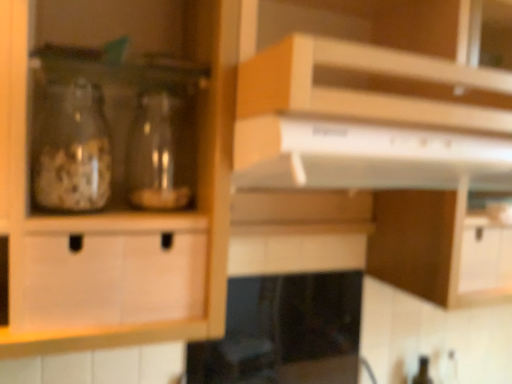
Question: From the image's perspective, does white glossy exhaust hood at upper center appear higher than black glass stove at lower center?

Choices:
 (A) yes
 (B) no

Answer: (A)

Question: Can you confirm if white glossy exhaust hood at upper center is wider than black glass stove at lower center?

Choices:
 (A) no
 (B) yes

Answer: (A)

Question: Is white glossy exhaust hood at upper center next to black glass stove at lower center?

Choices:
 (A) yes
 (B) no

Answer: (B)

Question: Is black glass stove at lower center a part of white glossy exhaust hood at upper center?

Choices:
 (A) no
 (B) yes

Answer: (A)

Question: Is white glossy exhaust hood at upper center thinner than black glass stove at lower center?

Choices:
 (A) no
 (B) yes

Answer: (B)

Question: Is the depth of white glossy exhaust hood at upper center greater than that of black glass stove at lower center?

Choices:
 (A) no
 (B) yes

Answer: (B)

Question: From the image's perspective, is black glass stove at lower center located beneath transparent glass jar at left, the 2th glass bottle when ordered from right to left?

Choices:
 (A) no
 (B) yes

Answer: (B)

Question: Is black glass stove at lower center facing away from transparent glass jar at left, the first glass bottle from the left?

Choices:
 (A) no
 (B) yes

Answer: (A)

Question: From a real-world perspective, is black glass stove at lower center beneath transparent glass jar at left, the 2th glass bottle when ordered from right to left?

Choices:
 (A) no
 (B) yes

Answer: (B)

Question: From a real-world perspective, is black glass stove at lower center over transparent glass jar at left, the first glass bottle from the left?

Choices:
 (A) yes
 (B) no

Answer: (B)

Question: Considering the relative sizes of black glass stove at lower center and transparent glass jar at left, the first glass bottle from the left, in the image provided, is black glass stove at lower center wider than transparent glass jar at left, the first glass bottle from the left,?

Choices:
 (A) no
 (B) yes

Answer: (B)

Question: From the image's perspective, is black glass stove at lower center on transparent glass jar at left, the 2th glass bottle when ordered from right to left?

Choices:
 (A) no
 (B) yes

Answer: (A)

Question: From a real-world perspective, is black glass stove at lower center positioned over white glossy exhaust hood at upper center based on gravity?

Choices:
 (A) yes
 (B) no

Answer: (B)